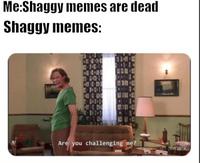
Locate an element on the screen. The height and width of the screenshot is (163, 200). rocking chair is located at coordinates (182, 143).